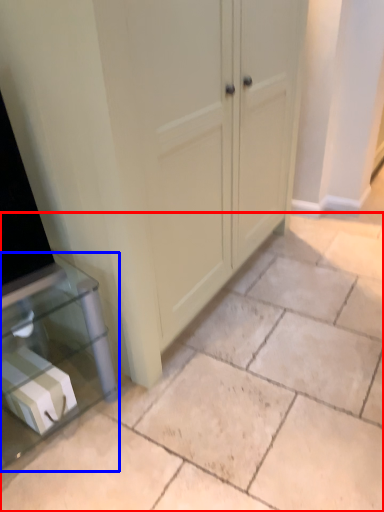
Question: Which object is closer to the camera taking this photo, concrete (highlighted by a red box) or furniture (highlighted by a blue box)?

Choices:
 (A) concrete
 (B) furniture

Answer: (A)